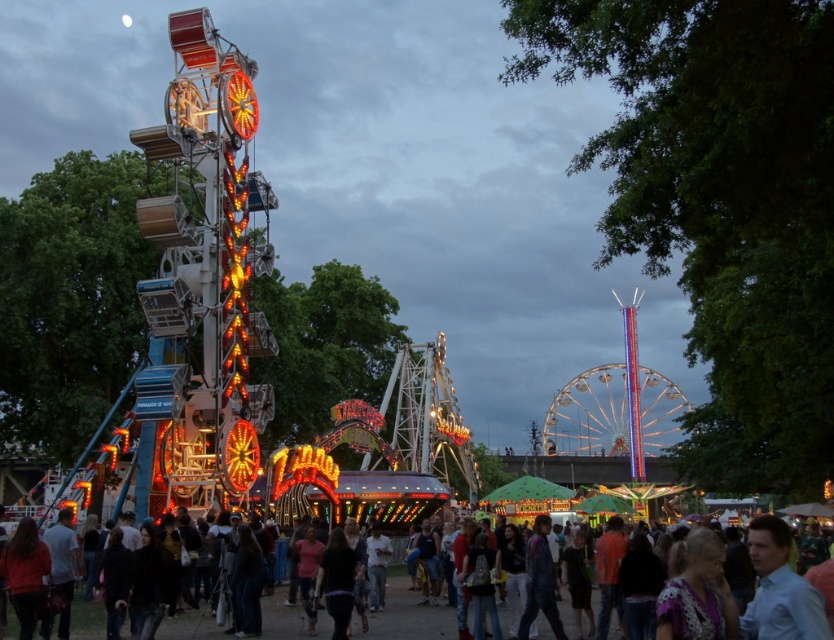
Question: Does illuminated metal ferris wheel at center have a greater width compared to light blue shirt at lower right?

Choices:
 (A) yes
 (B) no

Answer: (A)

Question: Which of the following is the closest to the observer?

Choices:
 (A) illuminated metal ferris wheel at center
 (B) light blue shirt at lower right
 (C) dark blue shirt at center

Answer: (B)

Question: Which of these objects is positioned farthest from the illuminated metal ferris wheel at center?

Choices:
 (A) light blue shirt at lower right
 (B) dark blue shirt at center

Answer: (A)

Question: Can you confirm if illuminated metal ferris wheel at center is positioned above light blue shirt at lower right?

Choices:
 (A) no
 (B) yes

Answer: (A)

Question: Which of the following is the closest to the observer?

Choices:
 (A) (752, 557)
 (B) (565, 392)

Answer: (A)

Question: Does illuminated metal ferris wheel at center come behind dark blue shirt at center?

Choices:
 (A) no
 (B) yes

Answer: (B)